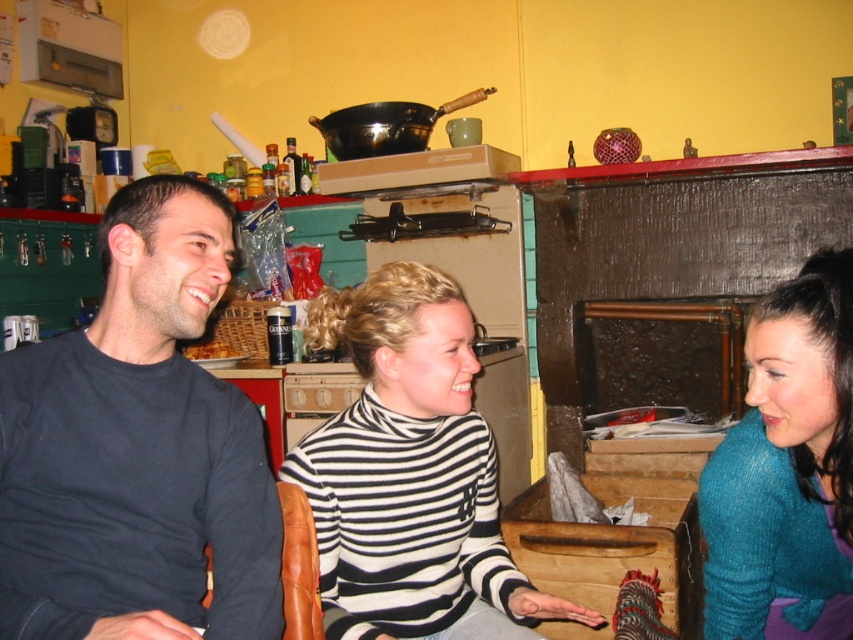
Question: From the image, what is the correct spatial relationship of black and white striped sweater at center in relation to teal sweater at right?

Choices:
 (A) right
 (B) left

Answer: (B)

Question: Which point is closer to the camera?

Choices:
 (A) (196, 356)
 (B) (347, 420)
 (C) (770, 611)

Answer: (C)

Question: In this image, where is black cotton shirt at left located relative to black and white striped sweater at center?

Choices:
 (A) left
 (B) right

Answer: (A)

Question: Considering the real-world distances, which object is farthest from the teal sweater at right?

Choices:
 (A) black and white striped sweater at center
 (B) black cotton shirt at left

Answer: (B)

Question: Which of the following is the closest to the observer?

Choices:
 (A) black and white striped sweater at center
 (B) teal sweater at right
 (C) brown crumbly bread at left
 (D) black cotton shirt at left

Answer: (D)

Question: Is the position of teal sweater at right less distant than that of brown crumbly bread at left?

Choices:
 (A) no
 (B) yes

Answer: (B)